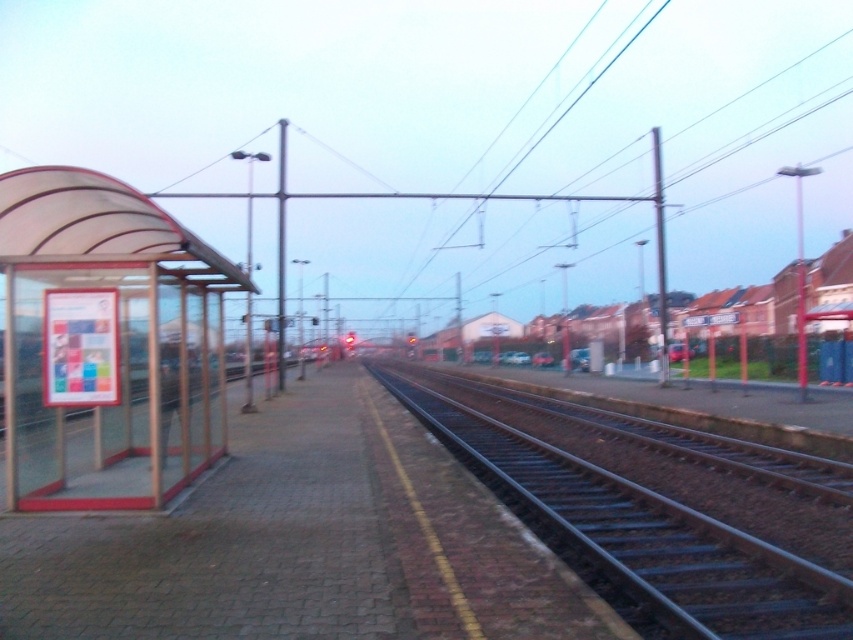
Question: Does transparent plastic bus stop at left appear under black steel train track at center?

Choices:
 (A) no
 (B) yes

Answer: (A)

Question: Which object appears closest to the camera in this image?

Choices:
 (A) transparent plastic bus stop at left
 (B) black steel train track at center

Answer: (B)

Question: From the image, what is the correct spatial relationship of transparent plastic bus stop at left in relation to black steel train track at center?

Choices:
 (A) below
 (B) above

Answer: (B)

Question: Which point is closer to the camera?

Choices:
 (A) (109, 417)
 (B) (637, 486)

Answer: (A)

Question: Does transparent plastic bus stop at left appear under black steel train track at center?

Choices:
 (A) no
 (B) yes

Answer: (A)